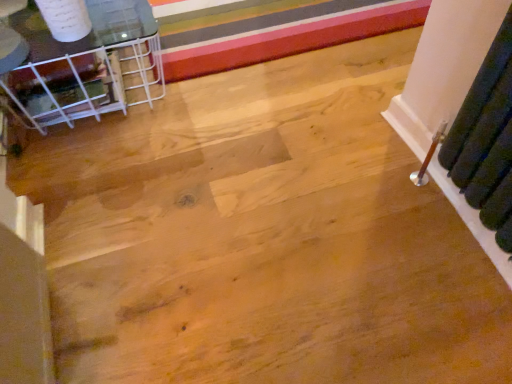
Question: Considering the positions of clear glass table at upper left and multicolored striped carpet at upper center in the image, is clear glass table at upper left taller or shorter than multicolored striped carpet at upper center?

Choices:
 (A) tall
 (B) short

Answer: (A)

Question: From the image's perspective, is clear glass table at upper left located above or below multicolored striped carpet at upper center?

Choices:
 (A) above
 (B) below

Answer: (B)

Question: From a real-world perspective, is clear glass table at upper left above or below multicolored striped carpet at upper center?

Choices:
 (A) below
 (B) above

Answer: (B)

Question: From a real-world perspective, is multicolored striped carpet at upper center physically located above or below clear glass table at upper left?

Choices:
 (A) above
 (B) below

Answer: (B)

Question: Is point (233, 51) closer or farther from the camera than point (101, 46)?

Choices:
 (A) farther
 (B) closer

Answer: (A)

Question: Based on their positions, is multicolored striped carpet at upper center located to the left or right of clear glass table at upper left?

Choices:
 (A) left
 (B) right

Answer: (B)

Question: Considering the positions of multicolored striped carpet at upper center and clear glass table at upper left in the image, is multicolored striped carpet at upper center taller or shorter than clear glass table at upper left?

Choices:
 (A) tall
 (B) short

Answer: (B)